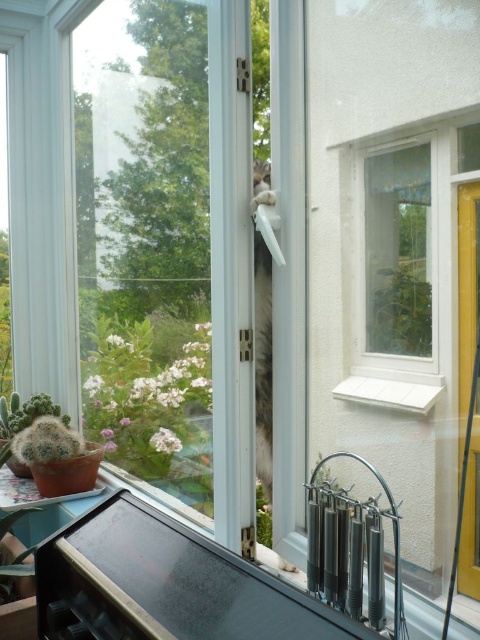
You are standing in front of the glass door with a sliding mechanism. There is a point marked at coordinates point (195, 346). Can you reach this point without moving your feet?

The point (195, 346) is 5.03 feet away from the viewer, so yes, you can reach it without moving your feet since it is within arm reach.

You are standing in the room and want to place a new potted plant on the table near the glass door. The current green leafy plant at upper right is already there. Where exactly should you place the new plant to avoid blocking the view of the existing plant from the door?

The green leafy plant at upper right is located at point (x=400, y=314), so place the new plant away from that coordinate to keep the view clear.

You are a cat trying to squeeze through the gap in the glass door. You see the green leafy plant at upper right and the green matte cactus at lower left. Which one is closer to you as you approach the door?

The green leafy plant at upper right is in front of the green matte cactus at lower left, so the green leafy plant at upper right is closer to you as you approach the door.